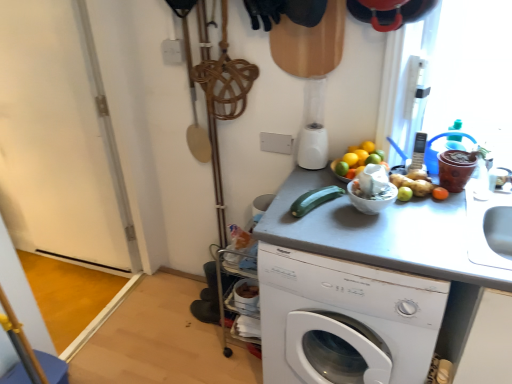
Question: From the image's perspective, is white glossy bowl at upper right below white plastic washing machine at center?

Choices:
 (A) no
 (B) yes

Answer: (A)

Question: Is white glossy bowl at upper right taller than white plastic washing machine at center?

Choices:
 (A) yes
 (B) no

Answer: (B)

Question: Are white glossy bowl at upper right and white plastic washing machine at center located far from each other?

Choices:
 (A) no
 (B) yes

Answer: (A)

Question: Is white glossy bowl at upper right wider than white plastic washing machine at center?

Choices:
 (A) no
 (B) yes

Answer: (A)

Question: Does white glossy bowl at upper right have a lesser height compared to white plastic washing machine at center?

Choices:
 (A) yes
 (B) no

Answer: (A)

Question: Based on their sizes in the image, would you say gray matte counter top at center is bigger or smaller than white plastic washing machine at center?

Choices:
 (A) big
 (B) small

Answer: (A)

Question: Is point (419, 249) closer or farther from the camera than point (355, 329)?

Choices:
 (A) farther
 (B) closer

Answer: (B)

Question: Considering their positions, is gray matte counter top at center located in front of or behind white plastic washing machine at center?

Choices:
 (A) front
 (B) behind

Answer: (A)

Question: Would you say gray matte counter top at center is to the left or to the right of white plastic washing machine at center in the picture?

Choices:
 (A) right
 (B) left

Answer: (A)

Question: Is white glossy bowl at upper right spatially inside green matte cucumber at center, or outside of it?

Choices:
 (A) inside
 (B) outside

Answer: (B)

Question: In the image, is white glossy bowl at upper right positioned in front of or behind green matte cucumber at center?

Choices:
 (A) front
 (B) behind

Answer: (A)

Question: In terms of height, does white glossy bowl at upper right look taller or shorter compared to green matte cucumber at center?

Choices:
 (A) short
 (B) tall

Answer: (B)

Question: Considering the positions of white glossy bowl at upper right and green matte cucumber at center in the image, is white glossy bowl at upper right wider or thinner than green matte cucumber at center?

Choices:
 (A) thin
 (B) wide

Answer: (A)

Question: In terms of height, does green matte cucumber at center look taller or shorter compared to silver metallic phone at upper right?

Choices:
 (A) short
 (B) tall

Answer: (A)

Question: Relative to silver metallic phone at upper right, is green matte cucumber at center in front or behind?

Choices:
 (A) front
 (B) behind

Answer: (A)